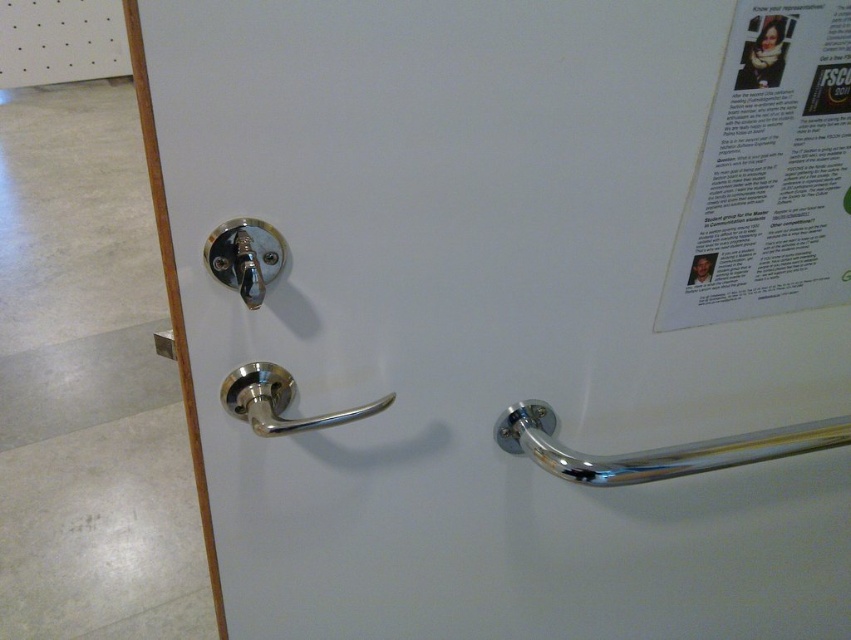
Looking at this image, you are standing in front of the white door and want to reach both the point at (838, 186) and the point at (215, 228). Which point will require you to stretch your arm less to touch?

Point at (838, 186) is closer to you than point at (215, 228) because it is further to the camera, so you will need to stretch your arm less to touch point at (838, 186).